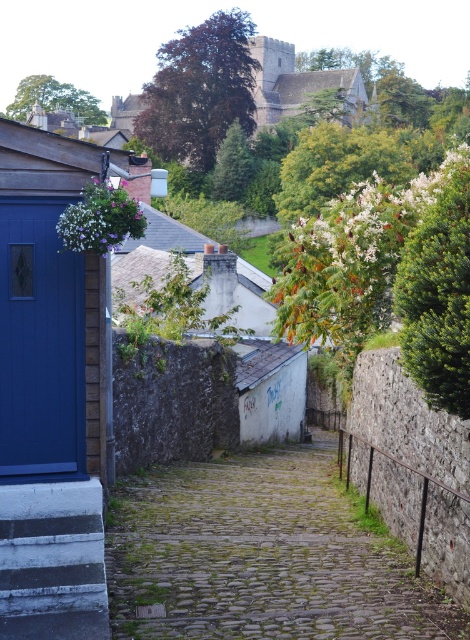
You are standing at the entrance of the alley and want to take a shortcut to the historic building. You see the cobblestone path at center and the white painted wood stairs at lower left. Which one is closer to the right side of the alley?

The cobblestone path at center is positioned on the right side of white painted wood stairs at lower left, so the cobblestone path at center is closer to the right side of the alley.

You are a delivery person carrying a package that requires a clear path of at least 3 meters to maneuver safely. You need to pass through the alleyway shown in the image. Given the distance between the cobblestone path at center and the matte blue door at left, can you safely navigate through this area with your package?

The cobblestone path at center and the matte blue door at left are 2.60 meters apart from each other. Since the required clear path is 3 meters, the distance is insufficient, so you cannot safely navigate through this area with your package.

Based on the photo, you are a visitor standing in the alleyway and want to enter the building through the matte blue door at left. To reach the door, you must first step over the white painted wood stairs at lower left. Is the door closer to you than the stairs?

The matte blue door at left is further to the viewer than the white painted wood stairs at lower left, so the door is actually farther away from you than the stairs. You would need to walk past the stairs to reach the door.